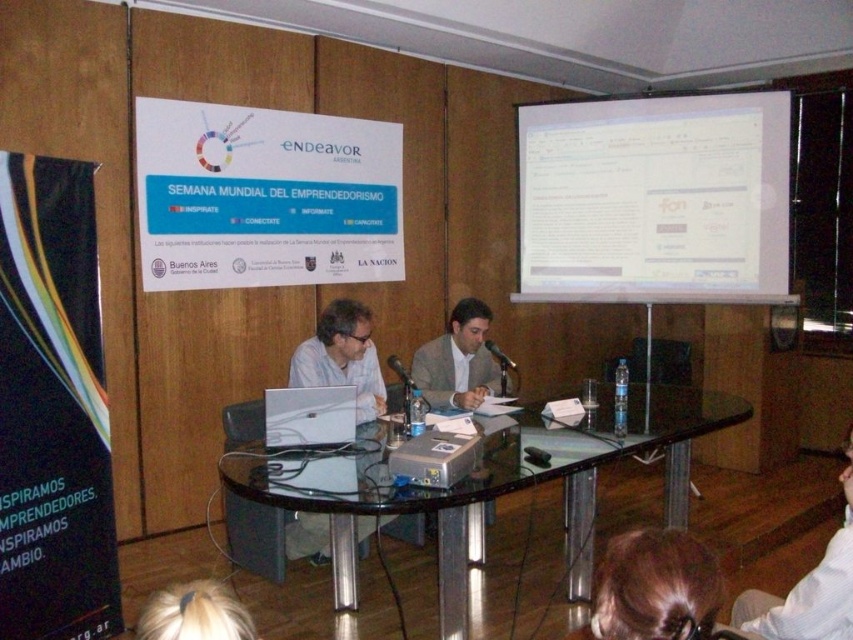
You are attending this event and need to take a photo of the brown hair at lower center and the silver metallic laptop at center. Which object should you focus on first to ensure both are in frame?

You should focus on the silver metallic laptop at center first because the brown hair at lower center is below it, so adjusting the camera to include the lower area will naturally capture both.

You are an attendee at this event and want to take a photo of the metallic projector at center without including the light brown suit at center in the frame. Is this possible given their positions?

The light brown suit at center is closer to you than the metallic projector at center. Since the suit is in front of the projector, it would block the view. Therefore, you cannot take a photo of the metallic projector at center without including the light brown suit at center in the frame.